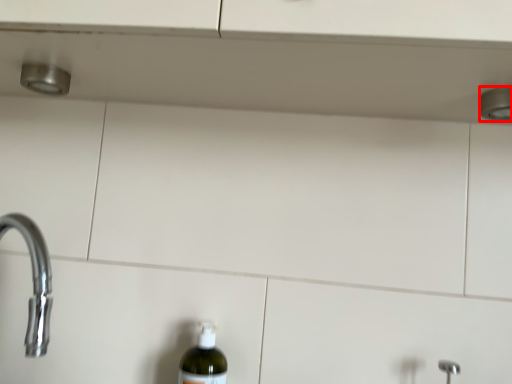
Question: From the image's perspective, where is shower (annotated by the red box) located relative to bottle?

Choices:
 (A) below
 (B) above

Answer: (B)